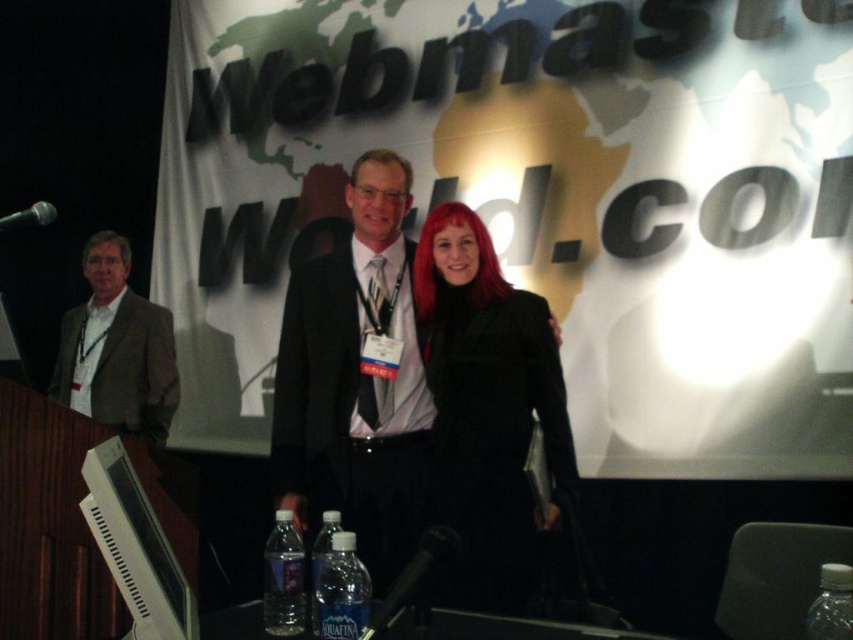
Is clear plastic bottle at lower center below clear plastic water bottle at center?

Indeed, clear plastic bottle at lower center is positioned under clear plastic water bottle at center.

Which is below, clear plastic bottle at lower center or clear plastic water bottle at center?

clear plastic bottle at lower center is lower down.

Which is in front, point (299, 570) or point (328, 516)?

Positioned in front is point (299, 570).

I want to click on clear plastic bottle at lower center, so click(283, 579).

Is black suit at center bigger than clear plastic bottle at lower center?

Yes.

Which of these two, black suit at center or clear plastic bottle at lower center, stands shorter?

clear plastic bottle at lower center

The width and height of the screenshot is (853, 640). Identify the location of black suit at center. (357, 380).

Between clear plastic water bottle at lower center and clear plastic water bottle at center, which one appears on the left side from the viewer's perspective?

From the viewer's perspective, clear plastic water bottle at center appears more on the left side.

Does clear plastic water bottle at lower center have a lesser height compared to clear plastic water bottle at center?

Correct, clear plastic water bottle at lower center is not as tall as clear plastic water bottle at center.

The image size is (853, 640). What do you see at coordinates (341, 589) in the screenshot?
I see `clear plastic water bottle at lower center` at bounding box center [341, 589].

Identify the location of clear plastic water bottle at lower center. This screenshot has width=853, height=640. (341, 589).